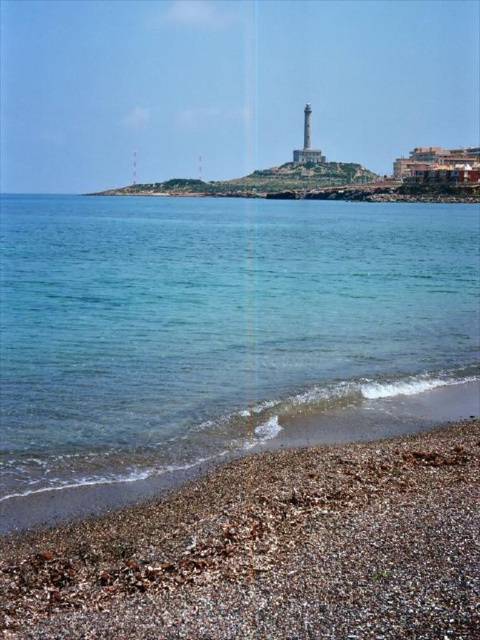
You are a beachcomber searching for hidden treasures. You notice clear water at lower left and smooth pebbles at lower right. According to the scene, which object is positioned more to the right side of the image?

The clear water at lower left is to the right of smooth pebbles at lower right, so the clear water at lower left is positioned more to the right side of the image.